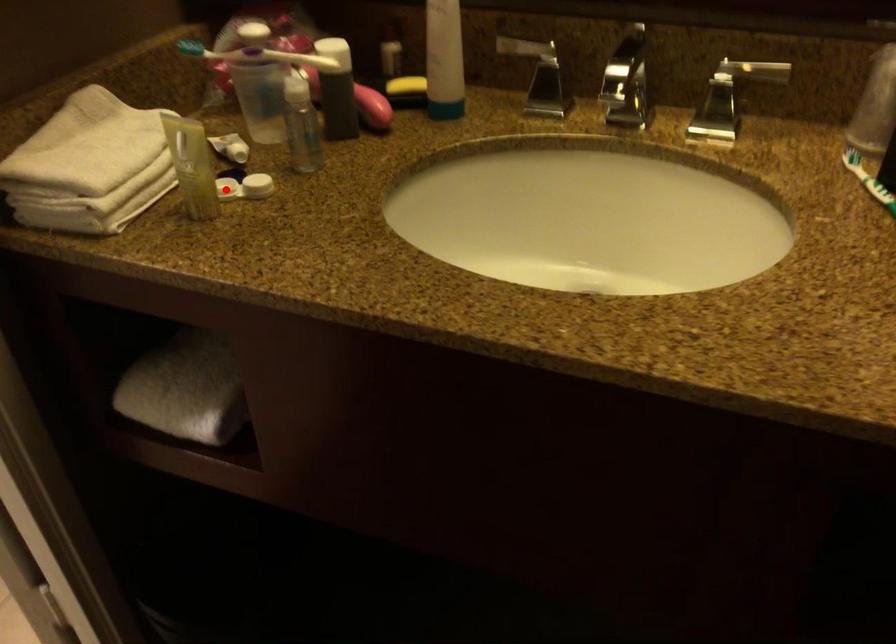
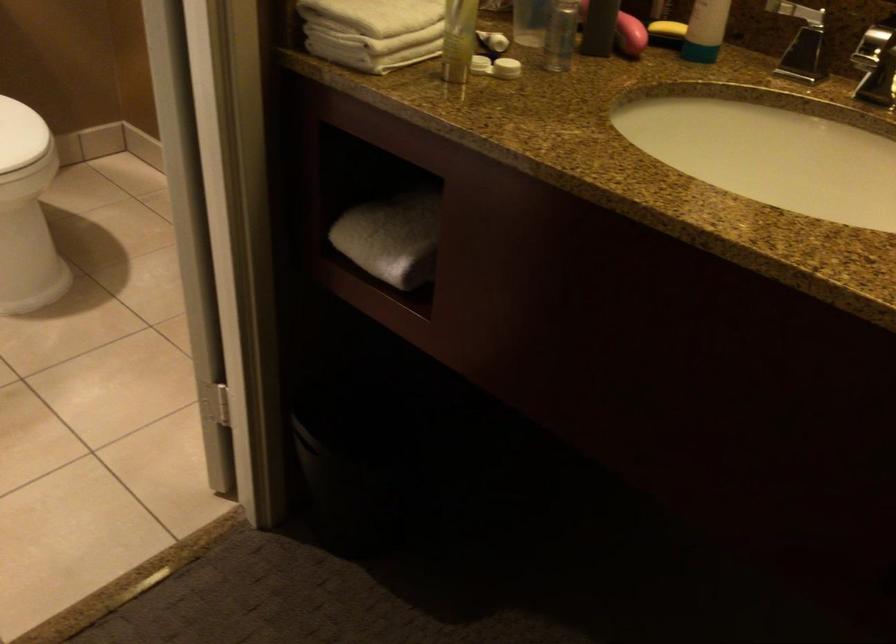
Locate, in the second image, the point that corresponds to the highlighted location in the first image.

(479, 64)